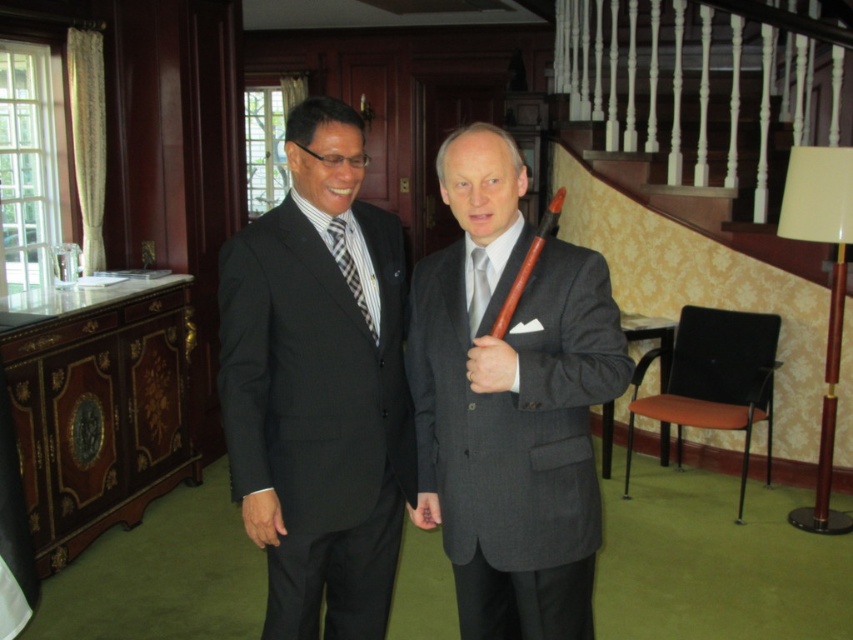
Question: Which of the following is the farthest from the observer?

Choices:
 (A) [x=349, y=289]
 (B) [x=312, y=193]
 (C) [x=476, y=282]
 (D) [x=576, y=492]

Answer: (A)

Question: Which of the following is the farthest from the observer?

Choices:
 (A) matte black suit at center
 (B) gray wool suit at center

Answer: (A)

Question: From the image, what is the correct spatial relationship of matte black suit at center in relation to black striped tie at center?

Choices:
 (A) right
 (B) left

Answer: (B)

Question: Considering the relative positions of matte black suit at center and gray wool suit at center in the image provided, where is matte black suit at center located with respect to gray wool suit at center?

Choices:
 (A) left
 (B) right

Answer: (A)

Question: Among these points, which one is farthest from the camera?

Choices:
 (A) (357, 300)
 (B) (274, 422)
 (C) (480, 304)
 (D) (456, 156)

Answer: (B)

Question: Is matte black suit at center thinner than gray wool suit at center?

Choices:
 (A) yes
 (B) no

Answer: (A)